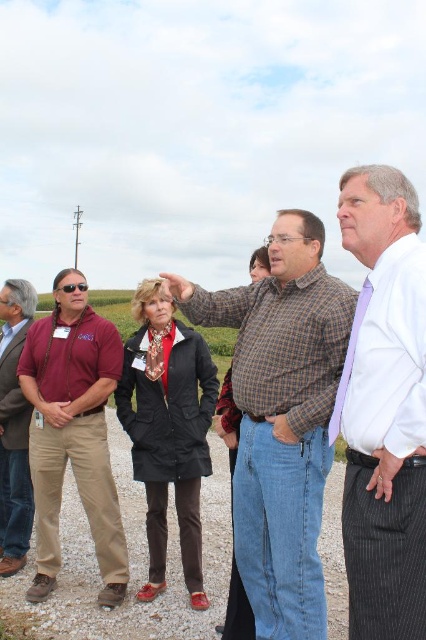
You are a photographer trying to capture a group photo of the scene. You need to ensure that the white striped shirt at center and the matte brown jacket at left are both visible in the frame. Considering their heights, which one might you need to ask to adjust their position to ensure both are fully visible?

The white striped shirt at center is taller than the matte brown jacket at left. To ensure both are fully visible, you might ask the person in the white striped shirt at center to crouch slightly or move back to avoid blocking the view of the shorter matte brown jacket at left.

You are a photographer trying to capture a group photo of the people in the scene. You want to ensure that both the white striped shirt at center and the matte brown jacket at left are clearly visible in the frame. Given their sizes, which one might you need to adjust your camera focus on more carefully to ensure clarity?

The white striped shirt at center is larger in size than the matte brown jacket at left, so you might need to focus more carefully on the matte brown jacket at left to ensure it remains clear in the photo since it is smaller and could be easily overlooked.

Looking at this image, you are a photographer positioned at the center of the scene. You want to take a photo that includes both the white striped shirt at center and the matte maroon shirt at left. Given that your camera has a maximum focus range of 5 meters, will both subjects be in focus?

The white striped shirt at center is 4.71 meters away from the matte maroon shirt at left. Since the distance between them is within the camera maximum focus range of 5 meters, both subjects will be in focus.